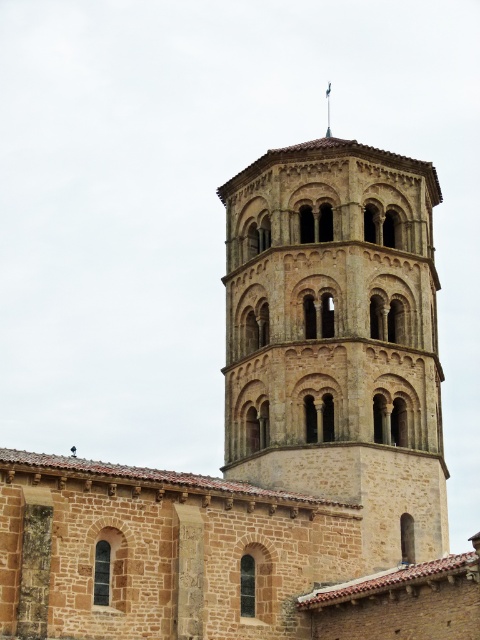
Looking at this image, who is positioned more to the right, brown stone bell tower at center or green stone spire at upper center?

green stone spire at upper center

Is brown stone bell tower at center bigger than green stone spire at upper center?

Yes.

Does point (324, 284) lie in front of point (328, 93)?

Yes, point (324, 284) is in front of point (328, 93).

I want to click on brown stone bell tower at center, so click(337, 339).